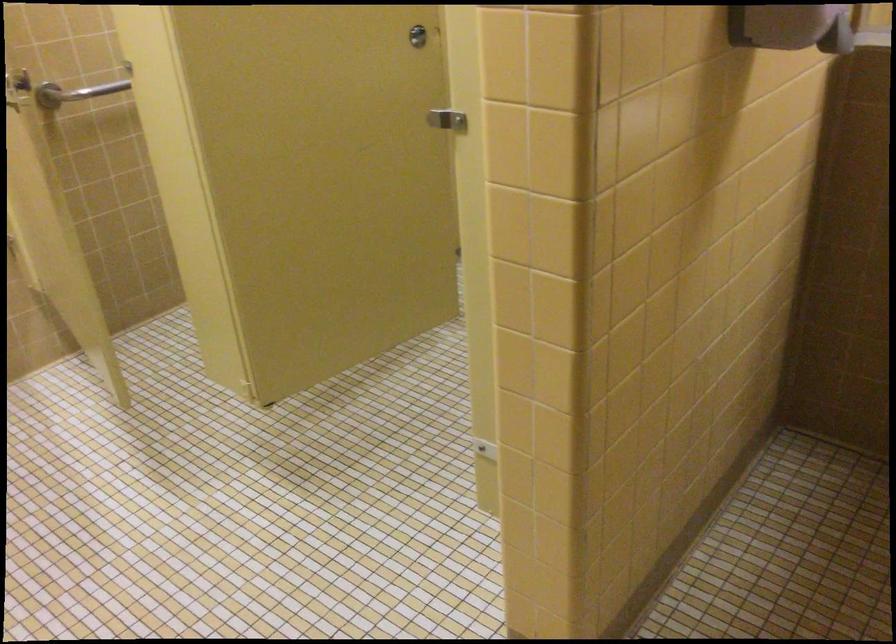
This screenshot has height=644, width=896. Describe the element at coordinates (446, 120) in the screenshot. I see `the stall door latch` at that location.